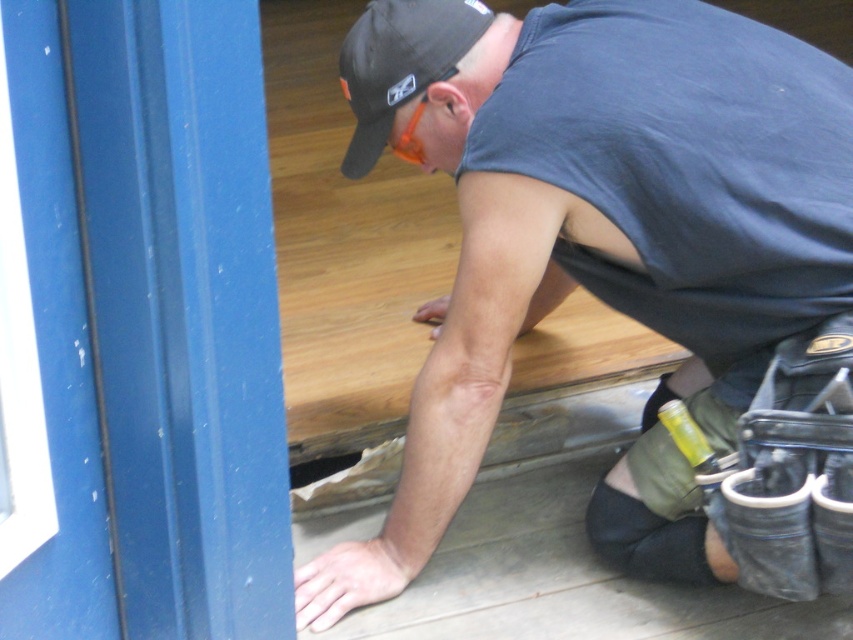
Can you confirm if matte blue door at left is wider than black fabric baseball cap at upper center?

Yes, matte blue door at left is wider than black fabric baseball cap at upper center.

Who is shorter, matte blue door at left or black fabric baseball cap at upper center?

With less height is black fabric baseball cap at upper center.

Locate an element on the screen. The image size is (853, 640). matte blue door at left is located at coordinates (154, 320).

Can you confirm if gray fabric construction worker at center is wider than matte blue door at left?

Yes.

Is gray fabric construction worker at center positioned in front of matte blue door at left?

No.

Is point (757, 141) farther from camera compared to point (229, 308)?

Yes, it is behind point (229, 308).

This screenshot has height=640, width=853. Identify the location of gray fabric construction worker at center. (598, 237).

Does gray fabric construction worker at center have a greater height compared to black fabric baseball cap at upper center?

Yes.

Can you confirm if gray fabric construction worker at center is positioned below black fabric baseball cap at upper center?

Yes.

Which is in front, point (363, 576) or point (432, 33)?

Point (432, 33)

Where is `gray fabric construction worker at center`? The height and width of the screenshot is (640, 853). gray fabric construction worker at center is located at coordinates (598, 237).